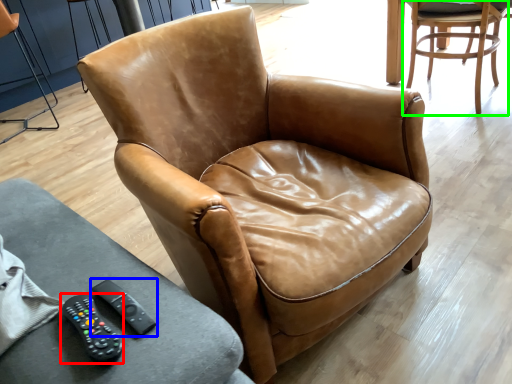
Question: Which object is positioned closest to remote (highlighted by a red box)? Select from remote (highlighted by a blue box) and chair (highlighted by a green box).

Choices:
 (A) remote
 (B) chair

Answer: (A)